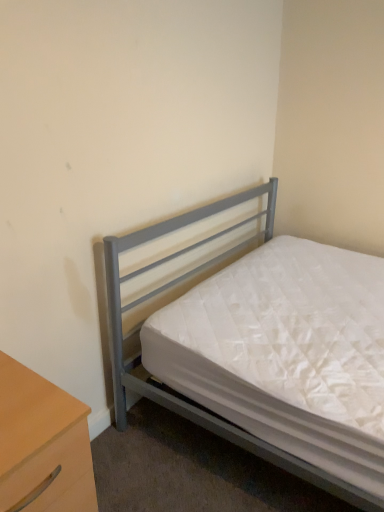
Question: Is light wood/wooden nightstand at lower left wider or thinner than metallic gray bed at center?

Choices:
 (A) wide
 (B) thin

Answer: (B)

Question: From the image's perspective, is light wood/wooden nightstand at lower left positioned above or below metallic gray bed at center?

Choices:
 (A) above
 (B) below

Answer: (B)

Question: Do you think light wood/wooden nightstand at lower left is within metallic gray bed at center, or outside of it?

Choices:
 (A) inside
 (B) outside

Answer: (B)

Question: From a real-world perspective, is metallic gray bed at center above or below light wood/wooden nightstand at lower left?

Choices:
 (A) above
 (B) below

Answer: (A)

Question: Is point (332, 480) closer or farther from the camera than point (41, 438)?

Choices:
 (A) farther
 (B) closer

Answer: (A)

Question: In terms of height, does metallic gray bed at center look taller or shorter compared to light wood/wooden nightstand at lower left?

Choices:
 (A) short
 (B) tall

Answer: (B)

Question: From the image's perspective, is metallic gray bed at center above or below light wood/wooden nightstand at lower left?

Choices:
 (A) below
 (B) above

Answer: (B)